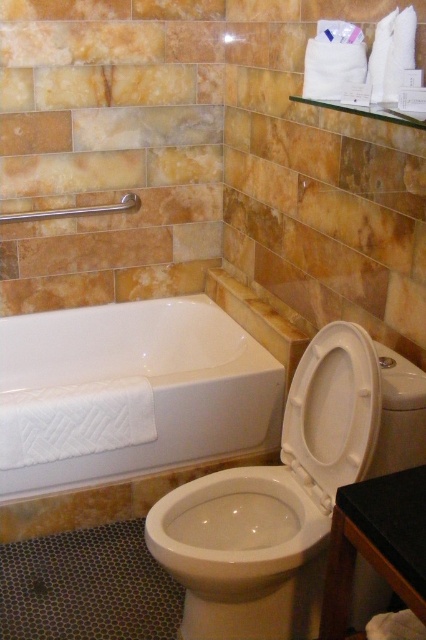
You are a plumber inspecting the bathroom layout. You see the white glossy toilet at lower right and the white glossy toilet bowl at center. Which one is closer to you from your current position?

The white glossy toilet at lower right is closer to you because it is in front of the white glossy toilet bowl at center.

You need to place a new bath mat that is 1 meter wide next to the white glossy bathtub at lower left. Given that the brushed metal towel bar at upper left is narrower than the bathtub, will the bath mat fit beside the bathtub without overlapping the towel bar?

The white glossy bathtub at lower left is wider than the brushed metal towel bar at upper left. Since the bath mat is 1 meter wide and the bathtub is wider, there should be enough space next to the bathtub to place the bath mat without overlapping the towel bar.